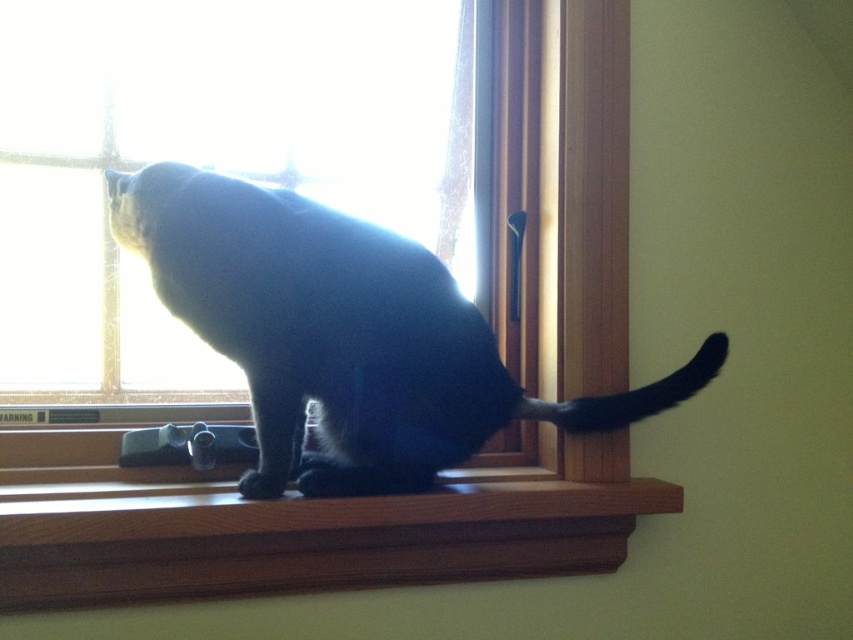
Looking at this image, which is below, black fur cat at center or wooden at center?

wooden at center

Which is more to the right, black fur cat at center or wooden at center?

black fur cat at center

Does point (271, 468) come closer to viewer compared to point (44, 522)?

No.

The height and width of the screenshot is (640, 853). In order to click on black fur cat at center in this screenshot , I will do `click(344, 333)`.

Between clear glass window at upper left and wooden at center, which one is positioned lower?

wooden at center is lower down.

Can you confirm if clear glass window at upper left is positioned to the left of wooden at center?

Yes, clear glass window at upper left is to the left of wooden at center.

Locate an element on the screen. This screenshot has width=853, height=640. clear glass window at upper left is located at coordinates (206, 157).

Can you confirm if clear glass window at upper left is smaller than black fur cat at center?

Actually, clear glass window at upper left might be larger than black fur cat at center.

Who is more forward, (45, 232) or (190, 307)?

Positioned in front is point (190, 307).

Locate an element on the screen. clear glass window at upper left is located at coordinates (206, 157).